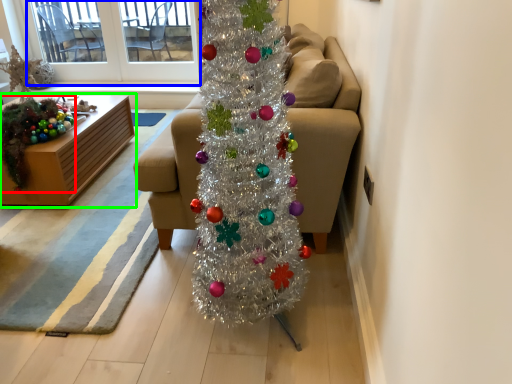
Question: Considering the real-world distances, which object is closest to christmas decoration (highlighted by a red box)? window screen (highlighted by a blue box) or furniture (highlighted by a green box).

Choices:
 (A) window screen
 (B) furniture

Answer: (B)